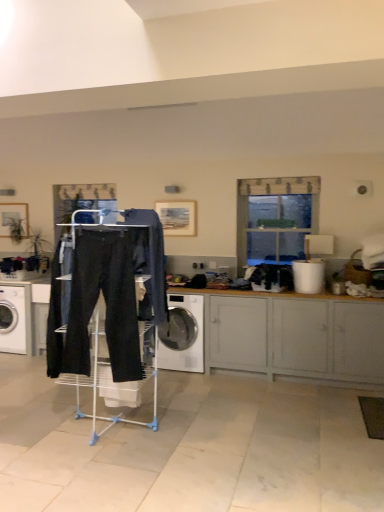
Question: Should I look upward or downward to see matte gray cabinet at lower right?

Choices:
 (A) up
 (B) down

Answer: (B)

Question: Considering the relative positions of white glossy washing machine at center, the 1th washing machine in the right-to-left sequence, and dark blue denim jeans at center in the image provided, is white glossy washing machine at center, the 1th washing machine in the right-to-left sequence, to the left of dark blue denim jeans at center from the viewer's perspective?

Choices:
 (A) no
 (B) yes

Answer: (A)

Question: Can you confirm if white glossy washing machine at center, which is the second washing machine in left-to-right order, is smaller than dark blue denim jeans at center?

Choices:
 (A) no
 (B) yes

Answer: (A)

Question: Does white glossy washing machine at center, the 1th washing machine in the right-to-left sequence, have a lesser width compared to dark blue denim jeans at center?

Choices:
 (A) no
 (B) yes

Answer: (A)

Question: From a real-world perspective, is white glossy washing machine at center, which is the second washing machine in left-to-right order, positioned under dark blue denim jeans at center based on gravity?

Choices:
 (A) yes
 (B) no

Answer: (A)

Question: Considering the relative sizes of white glossy washing machine at center, which is the second washing machine in left-to-right order, and dark blue denim jeans at center in the image provided, is white glossy washing machine at center, which is the second washing machine in left-to-right order, taller than dark blue denim jeans at center?

Choices:
 (A) yes
 (B) no

Answer: (B)

Question: From the image's perspective, is white glossy washing machine at center, which is the second washing machine in left-to-right order, below dark blue denim jeans at center?

Choices:
 (A) no
 (B) yes

Answer: (B)

Question: Considering the relative sizes of white glossy washing machine at left, acting as the 2th washing machine starting from the right, and matte gray cabinet at lower right in the image provided, is white glossy washing machine at left, acting as the 2th washing machine starting from the right, wider than matte gray cabinet at lower right?

Choices:
 (A) no
 (B) yes

Answer: (B)

Question: Is white glossy washing machine at left, the 1th washing machine viewed from the left, at the right side of matte gray cabinet at lower right?

Choices:
 (A) yes
 (B) no

Answer: (B)

Question: Is white glossy washing machine at left, the 1th washing machine viewed from the left, aimed at matte gray cabinet at lower right?

Choices:
 (A) yes
 (B) no

Answer: (B)

Question: Are white glossy washing machine at left, acting as the 2th washing machine starting from the right, and matte gray cabinet at lower right far apart?

Choices:
 (A) no
 (B) yes

Answer: (B)

Question: Is white glossy washing machine at left, the 1th washing machine viewed from the left, facing away from matte gray cabinet at lower right?

Choices:
 (A) no
 (B) yes

Answer: (A)

Question: Can you confirm if white glossy washing machine at left, the 1th washing machine viewed from the left, is smaller than matte gray cabinet at lower right?

Choices:
 (A) yes
 (B) no

Answer: (A)

Question: Is black cotton sweat pants at center next to matte gray cabinet at lower right?

Choices:
 (A) yes
 (B) no

Answer: (B)